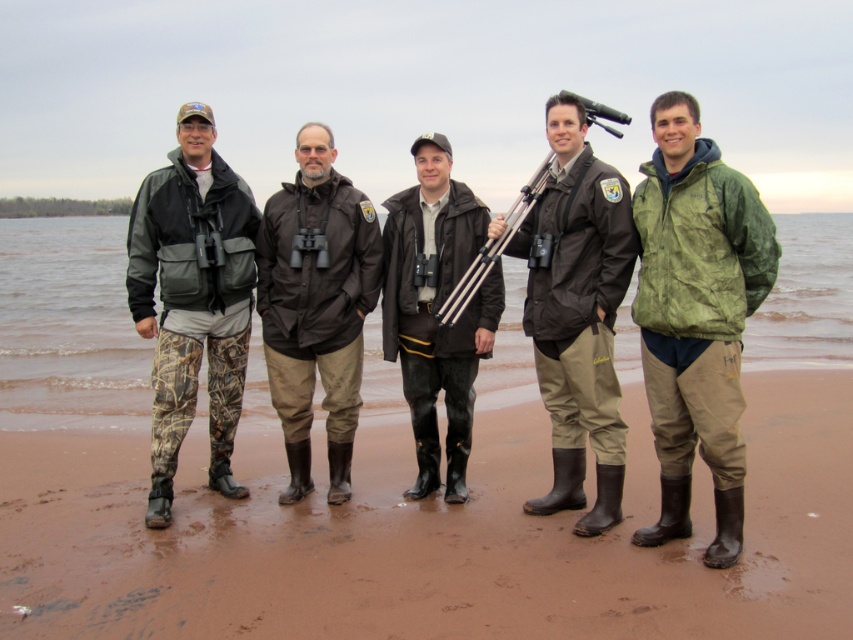
Question: Which point is farther to the camera?

Choices:
 (A) matte black tripod at center
 (B) green matte jacket at center

Answer: (A)

Question: Which of the following is the closest to the observer?

Choices:
 (A) (64, 289)
 (B) (631, 627)
 (C) (463, 413)

Answer: (B)

Question: Does camo pants at left have a lesser width compared to matte black jacket at center?

Choices:
 (A) yes
 (B) no

Answer: (A)

Question: Can you confirm if matte black jacket at center is smaller than brown matte jacket at center?

Choices:
 (A) no
 (B) yes

Answer: (A)

Question: Which point is farther to the camera?

Choices:
 (A) brown matte jacket at center
 (B) camo pants at left

Answer: (A)

Question: Is brown rubber boots at lower center below matte black jacket at center?

Choices:
 (A) no
 (B) yes

Answer: (B)